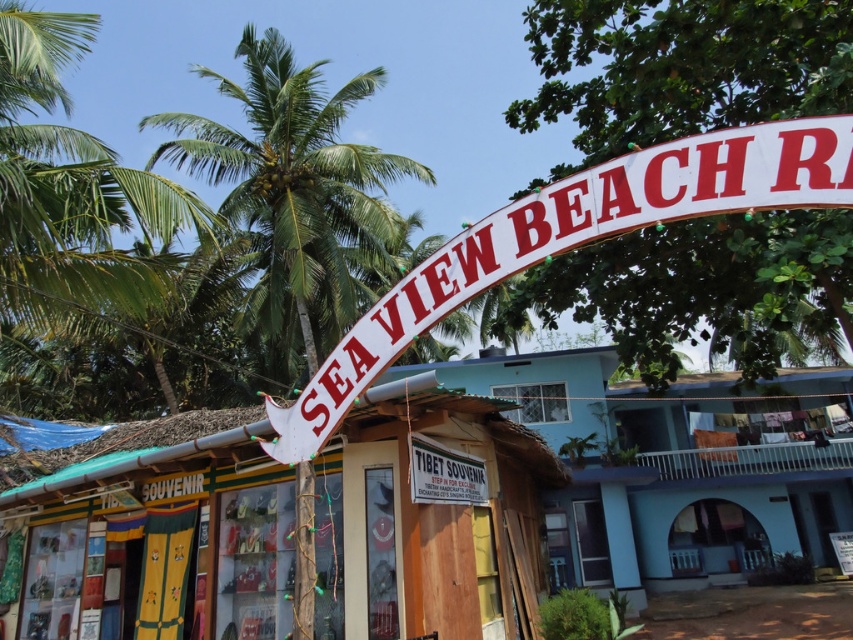
Can you confirm if wooden hut at center is wider than green leafy palm tree at upper center?

Yes.

Is wooden hut at center shorter than green leafy palm tree at upper center?

Yes.

Is point (840, 468) closer to viewer compared to point (206, 179)?

Yes.

The height and width of the screenshot is (640, 853). What are the coordinates of `wooden hut at center` in the screenshot? It's located at (676, 467).

Does point (822, 458) come in front of point (566, 180)?

No, (822, 458) is further to viewer.

Is wooden hut at center above white fabric sign at upper center?

No.

Locate an element on the screen. wooden hut at center is located at coordinates (676, 467).

Between white fabric sign at upper center and green leafy palm tree at upper center, which one appears on the right side from the viewer's perspective?

white fabric sign at upper center

Is white fabric sign at upper center to the right of green leafy palm tree at upper center from the viewer's perspective?

Indeed, white fabric sign at upper center is positioned on the right side of green leafy palm tree at upper center.

This screenshot has width=853, height=640. Find the location of `white fabric sign at upper center`. white fabric sign at upper center is located at coordinates pyautogui.click(x=573, y=241).

I want to click on white fabric sign at upper center, so click(573, 241).